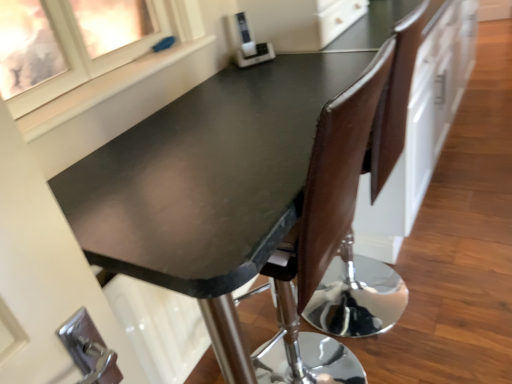
Question: Is white plastic appliance at upper center further to camera compared to brown leather chair at center?

Choices:
 (A) yes
 (B) no

Answer: (A)

Question: Is white plastic appliance at upper center at the right side of brown leather chair at center?

Choices:
 (A) no
 (B) yes

Answer: (A)

Question: Does white plastic appliance at upper center turn towards brown leather chair at center?

Choices:
 (A) no
 (B) yes

Answer: (B)

Question: Does white plastic appliance at upper center have a greater width compared to brown leather chair at center?

Choices:
 (A) yes
 (B) no

Answer: (B)

Question: From the image's perspective, does white plastic appliance at upper center appear lower than brown leather chair at center?

Choices:
 (A) yes
 (B) no

Answer: (B)

Question: Is brown leather chair at center completely or partially inside white plastic appliance at upper center?

Choices:
 (A) no
 (B) yes

Answer: (A)

Question: From the image's perspective, is white plastic appliance at upper center over matte black table at center?

Choices:
 (A) no
 (B) yes

Answer: (B)

Question: Does white plastic appliance at upper center have a larger size compared to matte black table at center?

Choices:
 (A) yes
 (B) no

Answer: (B)

Question: Is white plastic appliance at upper center outside of matte black table at center?

Choices:
 (A) no
 (B) yes

Answer: (B)

Question: Is white plastic appliance at upper center in contact with matte black table at center?

Choices:
 (A) yes
 (B) no

Answer: (B)

Question: From a real-world perspective, does white plastic appliance at upper center stand above matte black table at center?

Choices:
 (A) yes
 (B) no

Answer: (A)

Question: Is matte black table at center a part of white plastic appliance at upper center?

Choices:
 (A) yes
 (B) no

Answer: (B)

Question: Is matte glass window at upper left in contact with matte black table at center?

Choices:
 (A) no
 (B) yes

Answer: (A)